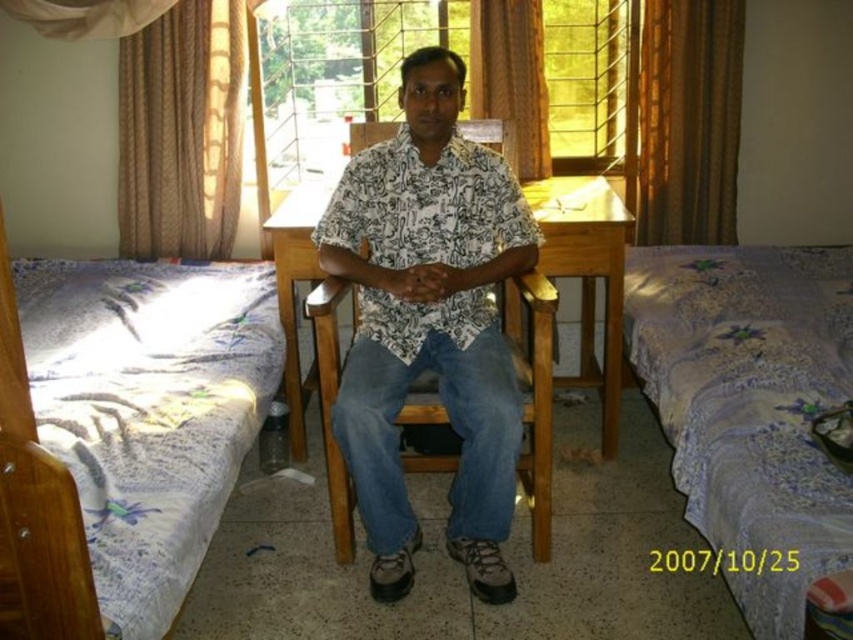
Where is the white printed shirt at center located in the room?

The white printed shirt at center is located at point (428, 323) in the room.

You need to place a large poster on the wall behind either the linen bedspread at right or the wooden table at center. Which location can accommodate the poster better based on the size of the objects?

The linen bedspread at right is bigger than the wooden table at center, so the poster would fit better behind the linen bedspread at right because it has a larger surface area.